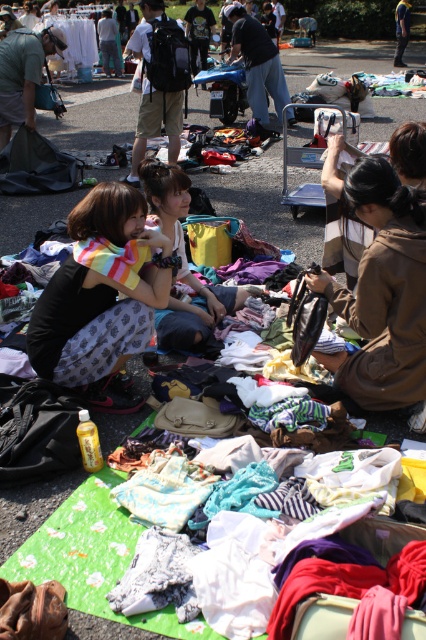
Question: Which point is farther to the camera?

Choices:
 (A) (377, 250)
 (B) (118, 70)
 (C) (399, 22)
 (D) (23, 70)

Answer: (B)

Question: Is matte black bag at upper left to the left of dark blue fabric at center from the viewer's perspective?

Choices:
 (A) no
 (B) yes

Answer: (B)

Question: Which of the following is the closest to the observer?

Choices:
 (A) matte black t-shirt at center
 (B) denim jacket at upper right

Answer: (A)

Question: Can you confirm if brown matte jacket at upper right is bigger than white cotton shirt at upper left?

Choices:
 (A) yes
 (B) no

Answer: (B)

Question: Considering the real-world distances, which object is closest to the matte black bag at upper left?

Choices:
 (A) printed cotton skirt at center
 (B) brown matte jacket at upper right

Answer: (B)

Question: Considering the relative positions of white cotton shirt at upper left and denim jacket at upper right in the image provided, where is white cotton shirt at upper left located with respect to denim jacket at upper right?

Choices:
 (A) right
 (B) left

Answer: (B)